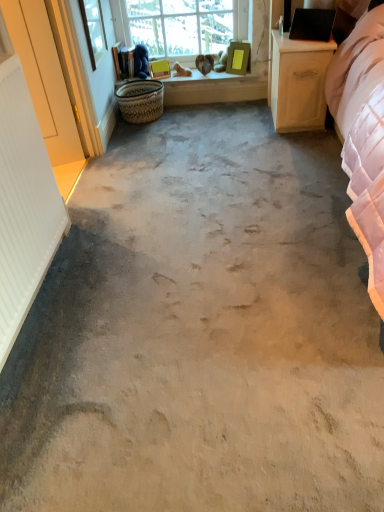
Locate an element on the screen. free space to the left of light wood/wooden nightstand at right is located at coordinates (236, 130).